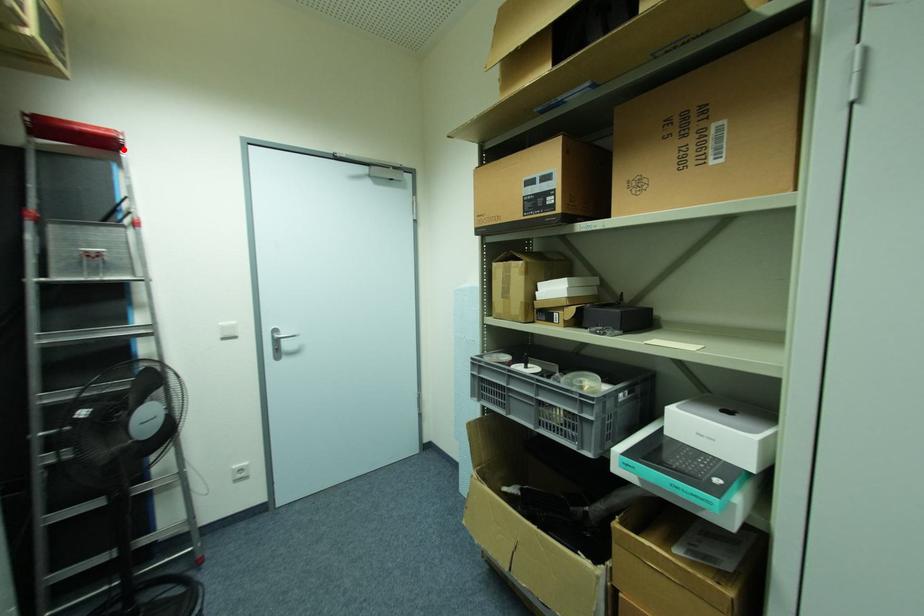
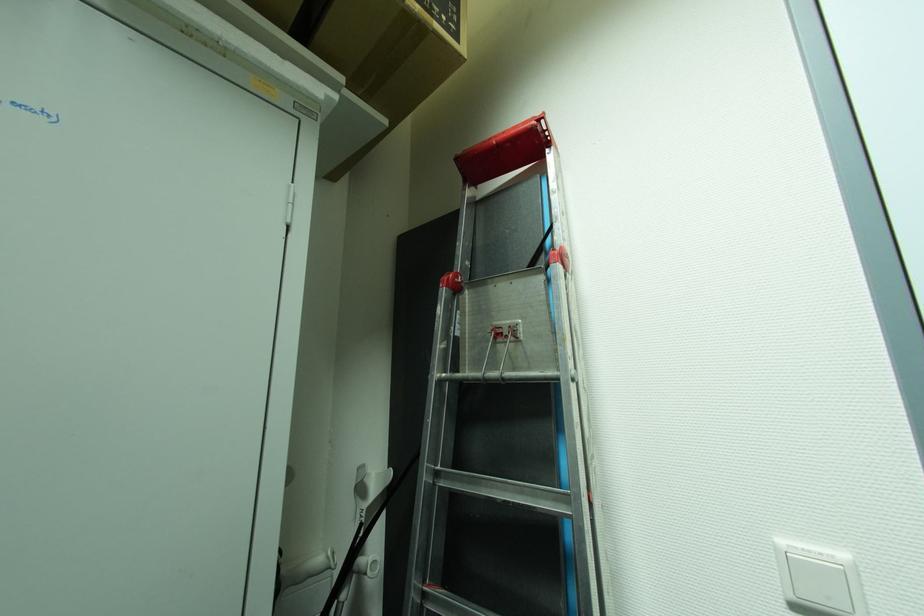
Locate, in the second image, the point that corresponds to the highlighted location in the first image.

(551, 144)